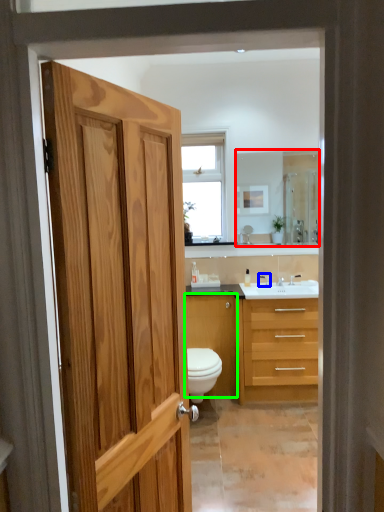
Question: Based on their relative distances, which object is farther from mirror (highlighted by a red box)? Choose from faucet (highlighted by a blue box) and cabinetry (highlighted by a green box).

Choices:
 (A) faucet
 (B) cabinetry

Answer: (B)